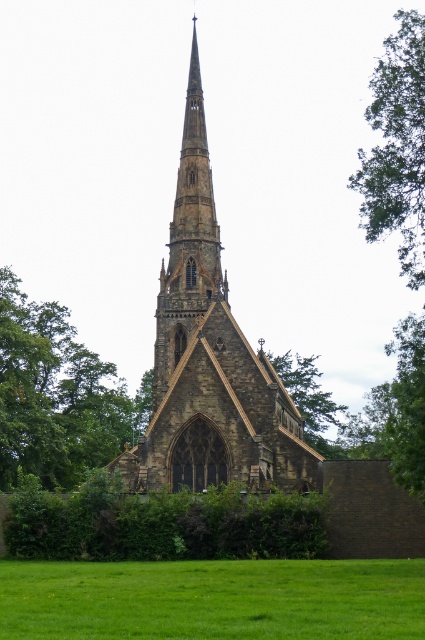
You are a photographer planning to capture the brown stone church at center and the green leafy tree at upper right in a single shot. Based on their sizes, which object should you focus on to ensure both are clearly visible in the frame?

The brown stone church at center is bigger than the green leafy tree at upper right, so focusing on the brown stone church at center will help ensure both are clearly visible since it takes up more space in the frame.